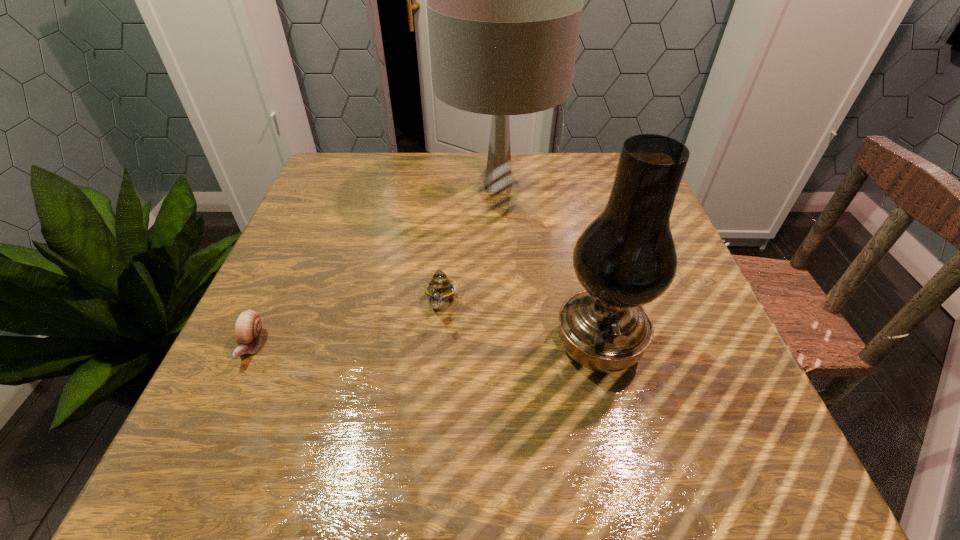
This screenshot has height=540, width=960. In order to click on the farthest object in this screenshot , I will do `click(504, 2)`.

Identify the location of oil lamp. (626, 257).

I want to click on the taller escargot, so click(x=440, y=289).

The height and width of the screenshot is (540, 960). Identify the location of the third tallest object. (440, 289).

The width and height of the screenshot is (960, 540). What are the coordinates of `the leftmost object` in the screenshot? It's located at (248, 328).

Identify the location of the left escargot. click(x=248, y=328).

Where is `vacant region located on the front-facing side of the farthest object`? vacant region located on the front-facing side of the farthest object is located at coordinates (339, 186).

Locate an element on the screen. The width and height of the screenshot is (960, 540). free location located 0.140m on the front-facing side of the farthest object is located at coordinates (383, 186).

Where is `vacant region located 0.120m on the front-facing side of the farthest object`? vacant region located 0.120m on the front-facing side of the farthest object is located at coordinates (391, 186).

The width and height of the screenshot is (960, 540). I want to click on free point located on the left of the oil lamp, so click(442, 346).